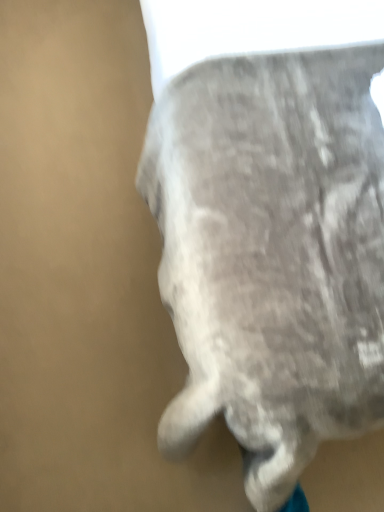
Identify the location of fuzzy gray cat at center. The width and height of the screenshot is (384, 512). (272, 254).

The image size is (384, 512). What do you see at coordinates (272, 254) in the screenshot?
I see `fuzzy gray cat at center` at bounding box center [272, 254].

This screenshot has height=512, width=384. What are the coordinates of `fuzzy gray cat at center` in the screenshot? It's located at (272, 254).